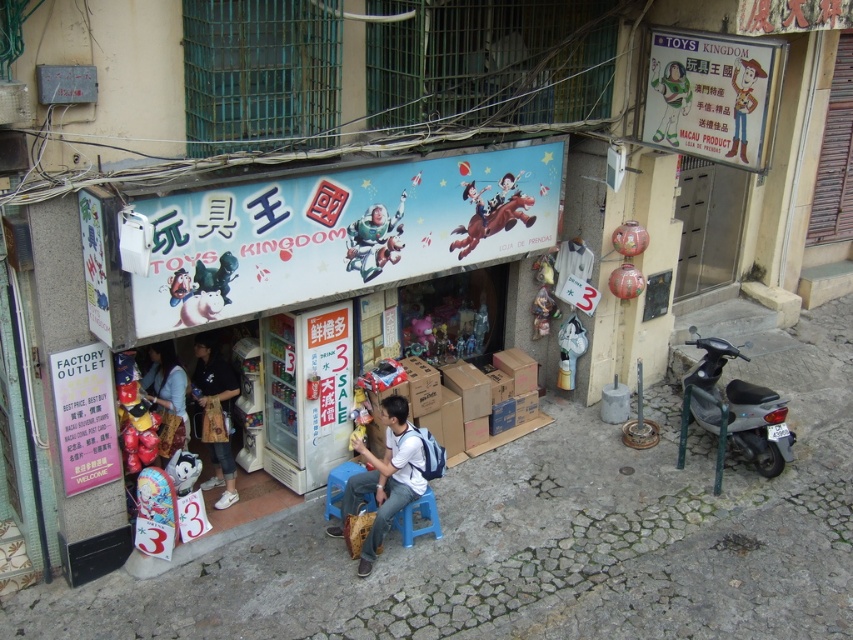
Can you confirm if metallic gray scooter at right is positioned to the right of matte blue shirt at center?

Indeed, metallic gray scooter at right is positioned on the right side of matte blue shirt at center.

Does point (737, 413) come farther from viewer compared to point (154, 385)?

Yes, point (737, 413) is behind point (154, 385).

Describe the element at coordinates (737, 406) in the screenshot. I see `metallic gray scooter at right` at that location.

Identify the location of metallic gray scooter at right. This screenshot has height=640, width=853. (737, 406).

Which is above, matte blue shirt at center or matte plastic buzz lightyear at upper right?

matte plastic buzz lightyear at upper right is above.

Is matte blue shirt at center smaller than matte plastic buzz lightyear at upper right?

Incorrect, matte blue shirt at center is not smaller in size than matte plastic buzz lightyear at upper right.

Which is in front, point (177, 442) or point (677, 76)?

Positioned in front is point (177, 442).

Find the location of `matte blue shirt at center`. matte blue shirt at center is located at coordinates (167, 396).

Is metallic gray scooter at right taller than black cotton shirt at center?

Indeed, metallic gray scooter at right has a greater height compared to black cotton shirt at center.

Who is positioned more to the right, metallic gray scooter at right or black cotton shirt at center?

From the viewer's perspective, metallic gray scooter at right appears more on the right side.

This screenshot has height=640, width=853. What do you see at coordinates (737, 406) in the screenshot? I see `metallic gray scooter at right` at bounding box center [737, 406].

Image resolution: width=853 pixels, height=640 pixels. I want to click on metallic gray scooter at right, so click(737, 406).